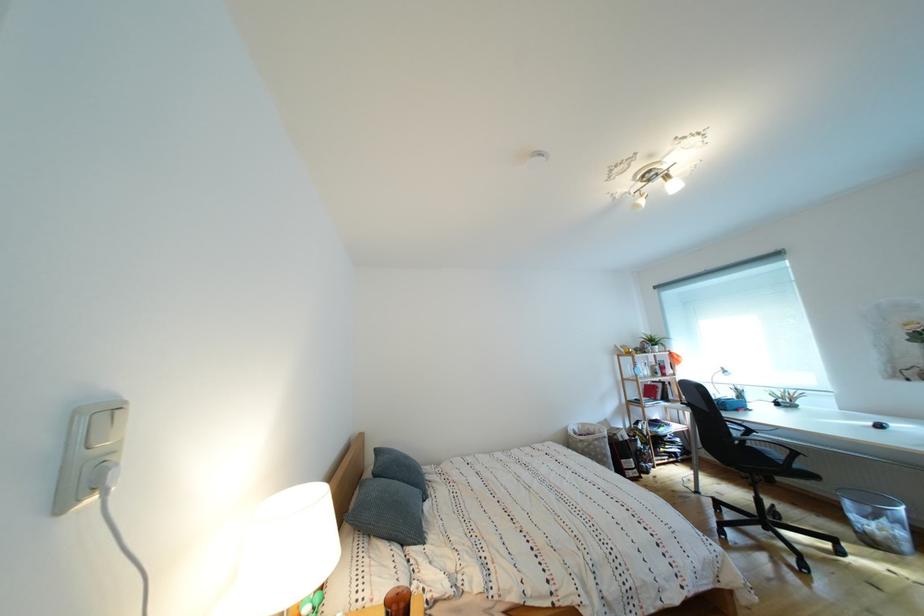
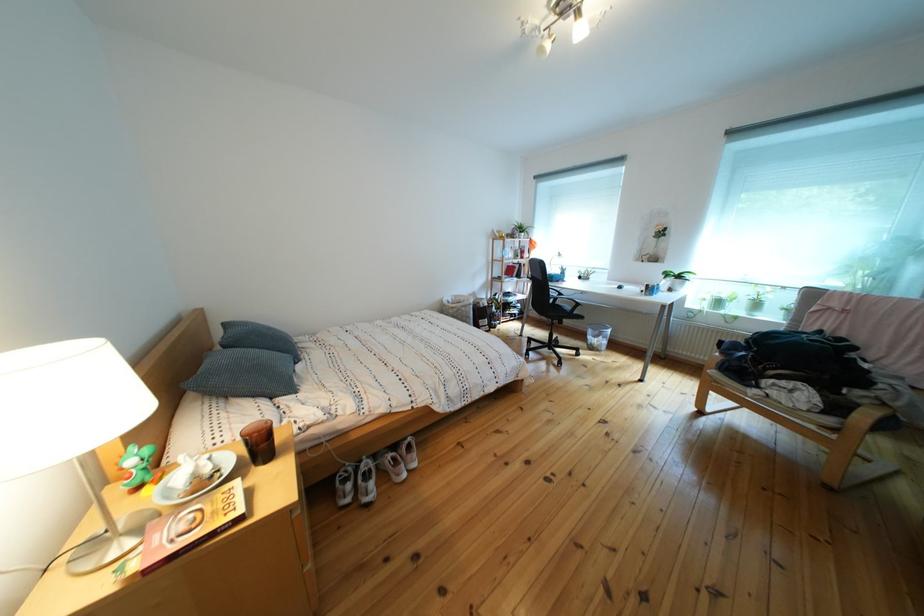
From the picture: First-person continuous shooting, in which direction is the camera rotating?

The camera rotated toward right-down.